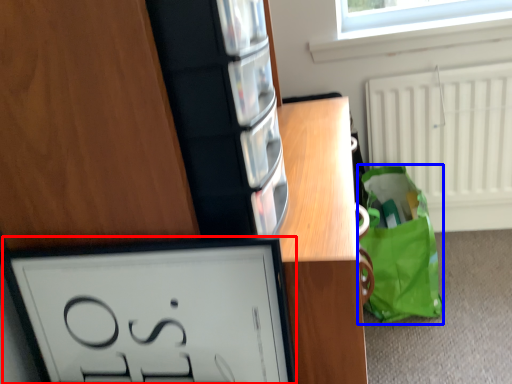
Question: Among these objects, which one is farthest to the camera, picture frame (highlighted by a red box) or tote bag (highlighted by a blue box)?

Choices:
 (A) picture frame
 (B) tote bag

Answer: (B)